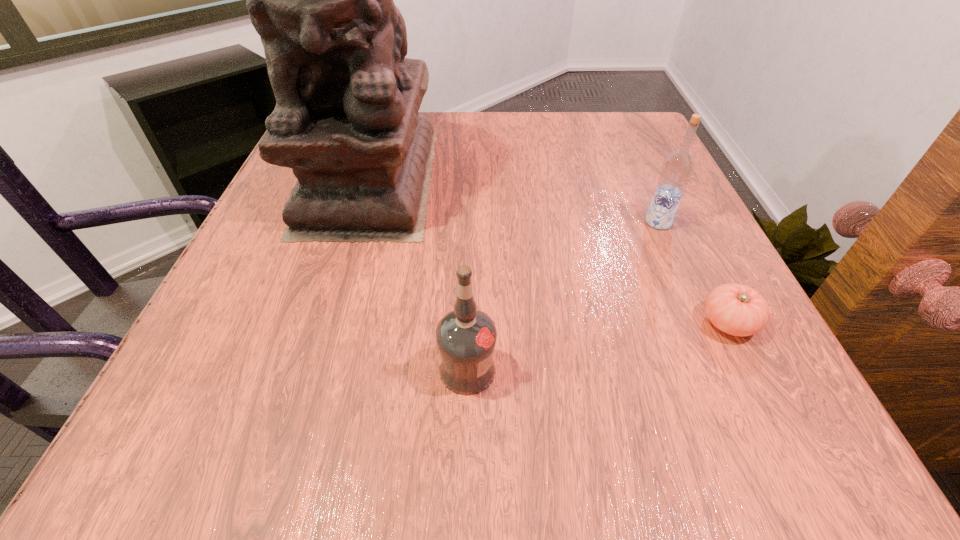
At what (x,y) coordinates should I click in order to perform the action: click on the tallest object. Please return your answer as a coordinate pair (x, y). Looking at the image, I should click on (346, 120).

The height and width of the screenshot is (540, 960). I want to click on sculpture, so click(346, 120).

Identify the location of the farther vodka. The height and width of the screenshot is (540, 960). coord(677,168).

At what (x,y) coordinates should I click in order to perform the action: click on the nearer vodka. Please return your answer as a coordinate pair (x, y). The height and width of the screenshot is (540, 960). Looking at the image, I should click on (466, 337).

At what (x,y) coordinates should I click in order to perform the action: click on the second object from left to right. Please return your answer as a coordinate pair (x, y). Looking at the image, I should click on (466, 337).

Locate an element on the screen. the third farthest object is located at coordinates (738, 310).

This screenshot has width=960, height=540. In order to click on tomato in this screenshot , I will do (738, 310).

Identify the location of free location located on the front-facing side of the leftmost object. (326, 323).

Where is `free spot located on the left of the farther vodka`? free spot located on the left of the farther vodka is located at coordinates (549, 222).

Find the location of `free space located on the front label of the left vodka`. free space located on the front label of the left vodka is located at coordinates (780, 370).